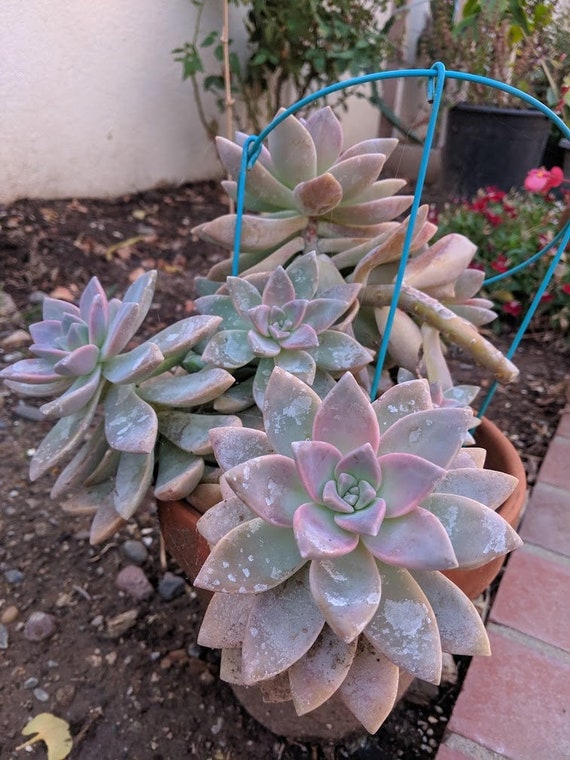
Find the location of a particular element. white wall is located at coordinates (134, 62).